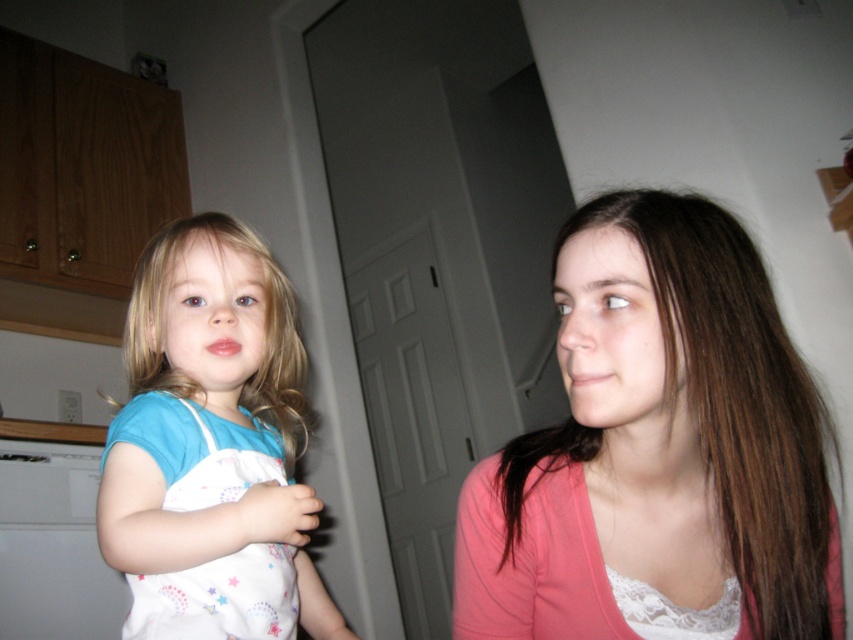
Is pink fabric at center thinner than white cotton dress at left?

No.

What do you see at coordinates (659, 449) in the screenshot?
I see `pink fabric at center` at bounding box center [659, 449].

Is point (519, 536) more distant than point (199, 298)?

No, (519, 536) is closer to viewer.

What are the coordinates of `pink fabric at center` in the screenshot? It's located at (659, 449).